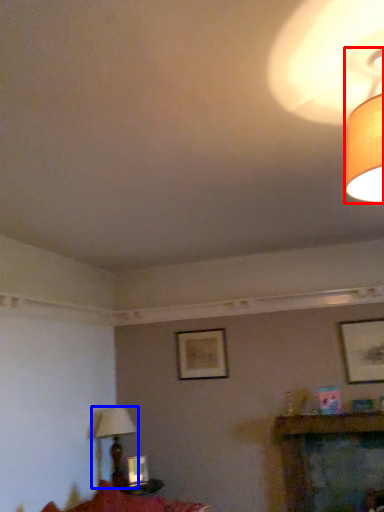
Question: Among these objects, which one is farthest to the camera, lamp (highlighted by a red box) or lamp (highlighted by a blue box)?

Choices:
 (A) lamp
 (B) lamp

Answer: (B)